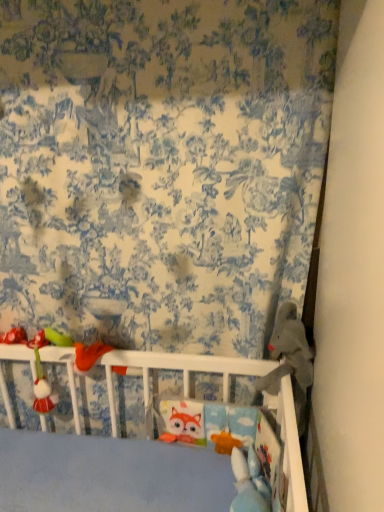
The height and width of the screenshot is (512, 384). What do you see at coordinates (42, 378) in the screenshot? I see `matte plastic rattle at left, which appears as the second toy when viewed from the right` at bounding box center [42, 378].

What do you see at coordinates (161, 166) in the screenshot? I see `blue printed fabric at upper center` at bounding box center [161, 166].

The width and height of the screenshot is (384, 512). Find the location of `gray plush bear at right, which is the 1th toy in right-to-left order`. gray plush bear at right, which is the 1th toy in right-to-left order is located at coordinates (290, 360).

Which of these two, gray plush bear at right, arranged as the second toy when viewed from the left, or blue printed fabric at upper center, is thinner?

blue printed fabric at upper center is thinner.

Between gray plush bear at right, arranged as the second toy when viewed from the left, and blue printed fabric at upper center, which one has larger size?

blue printed fabric at upper center.

Is gray plush bear at right, arranged as the second toy when viewed from the left, at the right side of blue printed fabric at upper center?

Yes, gray plush bear at right, arranged as the second toy when viewed from the left, is to the right of blue printed fabric at upper center.

Considering the positions of point (310, 369) and point (33, 231), is point (310, 369) closer or farther from the camera than point (33, 231)?

Point (310, 369) is closer to the camera than point (33, 231).

Between gray plush bear at right, which is the 1th toy in right-to-left order, and matte plastic rattle at left, which appears as the first toy when viewed from the left, which one has smaller size?

Smaller between the two is matte plastic rattle at left, which appears as the first toy when viewed from the left.

Which is more to the right, gray plush bear at right, which is the 1th toy in right-to-left order, or matte plastic rattle at left, which appears as the first toy when viewed from the left?

Positioned to the right is gray plush bear at right, which is the 1th toy in right-to-left order.

Who is more distant, gray plush bear at right, arranged as the second toy when viewed from the left, or matte plastic rattle at left, which appears as the second toy when viewed from the right?

matte plastic rattle at left, which appears as the second toy when viewed from the right, is further away from the camera.

Is gray plush bear at right, arranged as the second toy when viewed from the left, not within matte plastic rattle at left, which appears as the second toy when viewed from the right?

Indeed, gray plush bear at right, arranged as the second toy when viewed from the left, is completely outside matte plastic rattle at left, which appears as the second toy when viewed from the right.

From the picture: Does blue printed fabric at upper center have a greater height compared to matte plastic rattle at left, which appears as the first toy when viewed from the left?

Yes.

Is blue printed fabric at upper center next to matte plastic rattle at left, which appears as the first toy when viewed from the left?

No, blue printed fabric at upper center is not making contact with matte plastic rattle at left, which appears as the first toy when viewed from the left.

From a real-world perspective, is blue printed fabric at upper center beneath matte plastic rattle at left, which appears as the second toy when viewed from the right?

No.

Is point (160, 129) closer or farther from the camera than point (48, 412)?

Point (160, 129) is positioned closer to the camera compared to point (48, 412).

In the image, is matte plastic rattle at left, which appears as the first toy when viewed from the left, positioned in front of or behind gray plush bear at right, which is the 1th toy in right-to-left order?

matte plastic rattle at left, which appears as the first toy when viewed from the left, is positioned farther from the viewer than gray plush bear at right, which is the 1th toy in right-to-left order.

Considering the positions of point (48, 341) and point (304, 405), is point (48, 341) closer or farther from the camera than point (304, 405)?

Point (48, 341).

Locate an element on the screen. The height and width of the screenshot is (512, 384). toy lying below the gray plush bear at right, arranged as the second toy when viewed from the left (from the image's perspective) is located at coordinates (42, 378).

Which object is further away from the camera taking this photo, matte plastic rattle at left, which appears as the second toy when viewed from the right, or blue printed fabric at upper center?

Positioned behind is matte plastic rattle at left, which appears as the second toy when viewed from the right.

Does matte plastic rattle at left, which appears as the second toy when viewed from the right, have a lesser width compared to blue printed fabric at upper center?

No, matte plastic rattle at left, which appears as the second toy when viewed from the right, is not thinner than blue printed fabric at upper center.

Would you say matte plastic rattle at left, which appears as the second toy when viewed from the right, is to the left or to the right of blue printed fabric at upper center in the picture?

matte plastic rattle at left, which appears as the second toy when viewed from the right, is positioned on blue printed fabric at upper center's left side.

Can we say matte plastic rattle at left, which appears as the second toy when viewed from the right, lies outside blue printed fabric at upper center?

No, matte plastic rattle at left, which appears as the second toy when viewed from the right, is not entirely external to blue printed fabric at upper center.

Looking at this image, does blue printed fabric at upper center have a smaller size compared to gray plush bear at right, arranged as the second toy when viewed from the left?

No, blue printed fabric at upper center is not smaller than gray plush bear at right, arranged as the second toy when viewed from the left.

Is blue printed fabric at upper center beside gray plush bear at right, arranged as the second toy when viewed from the left?

No, blue printed fabric at upper center is not in contact with gray plush bear at right, arranged as the second toy when viewed from the left.

From a real-world perspective, is blue printed fabric at upper center under gray plush bear at right, arranged as the second toy when viewed from the left?

No, from a real-world perspective, blue printed fabric at upper center is not below gray plush bear at right, arranged as the second toy when viewed from the left.

Between blue printed fabric at upper center and gray plush bear at right, arranged as the second toy when viewed from the left, which one appears on the right side from the viewer's perspective?

From the viewer's perspective, gray plush bear at right, arranged as the second toy when viewed from the left, appears more on the right side.

Identify the location of the 1st toy below the blue printed fabric at upper center (from a real-world perspective). The image size is (384, 512). (290, 360).

The image size is (384, 512). I want to click on toy that is behind the gray plush bear at right, arranged as the second toy when viewed from the left, so click(x=42, y=378).

When comparing their distances from gray plush bear at right, arranged as the second toy when viewed from the left, does matte plastic rattle at left, which appears as the second toy when viewed from the right, or blue printed fabric at upper center seem closer?

The object closer to gray plush bear at right, arranged as the second toy when viewed from the left, is blue printed fabric at upper center.

Looking at this image, looking at the image, which one is located closer to matte plastic rattle at left, which appears as the second toy when viewed from the right, gray plush bear at right, which is the 1th toy in right-to-left order, or blue printed fabric at upper center?

The object closer to matte plastic rattle at left, which appears as the second toy when viewed from the right, is blue printed fabric at upper center.

Estimate the real-world distances between objects in this image. Which object is further from blue printed fabric at upper center, gray plush bear at right, which is the 1th toy in right-to-left order, or matte plastic rattle at left, which appears as the second toy when viewed from the right?

Based on the image, matte plastic rattle at left, which appears as the second toy when viewed from the right, appears to be further to blue printed fabric at upper center.

Considering their positions, is blue printed fabric at upper center positioned further to gray plush bear at right, which is the 1th toy in right-to-left order, than matte plastic rattle at left, which appears as the second toy when viewed from the right?

Based on the image, matte plastic rattle at left, which appears as the second toy when viewed from the right, appears to be further to gray plush bear at right, which is the 1th toy in right-to-left order.

Which object lies nearer to the anchor point matte plastic rattle at left, which appears as the first toy when viewed from the left, blue printed fabric at upper center or gray plush bear at right, arranged as the second toy when viewed from the left?

The object closer to matte plastic rattle at left, which appears as the first toy when viewed from the left, is blue printed fabric at upper center.

Considering their positions, is matte plastic rattle at left, which appears as the first toy when viewed from the left, positioned closer to blue printed fabric at upper center than gray plush bear at right, which is the 1th toy in right-to-left order?

Among the two, gray plush bear at right, which is the 1th toy in right-to-left order, is located nearer to blue printed fabric at upper center.

The image size is (384, 512). I want to click on curtain situated between matte plastic rattle at left, which appears as the first toy when viewed from the left, and gray plush bear at right, arranged as the second toy when viewed from the left, from left to right, so click(x=161, y=166).